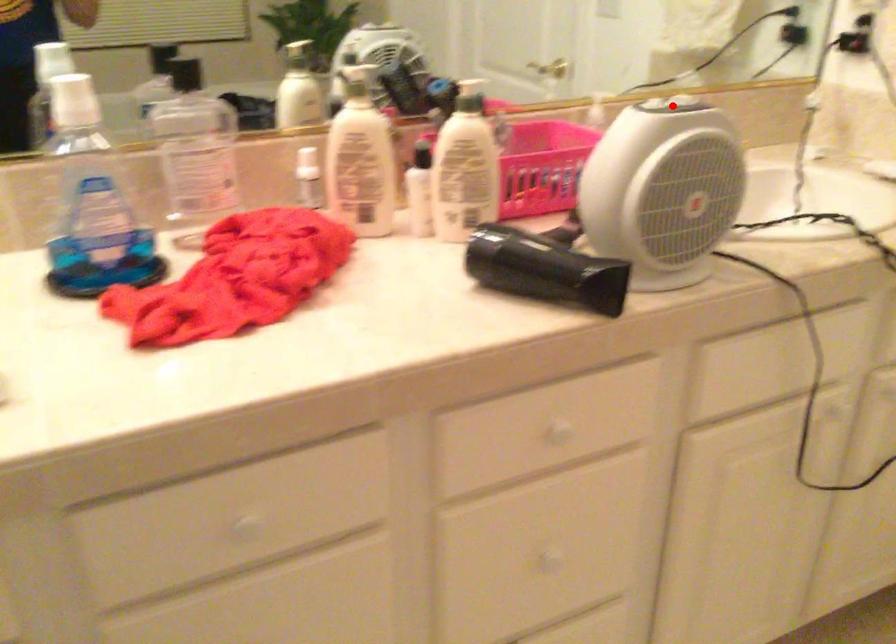
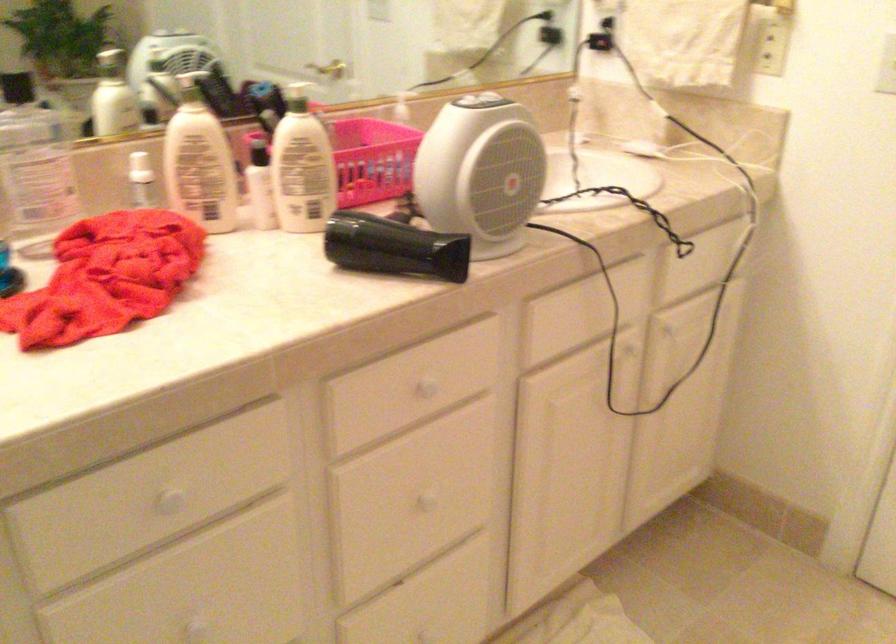
Question: I am providing you with two images of the same scene from different viewpoints. Image1 has a red point marked. In image2, the corresponding 3D location appears at what relative position? Reply with the corresponding letter.

Choices:
 (A) Closer
 (B) Farther

Answer: (B)